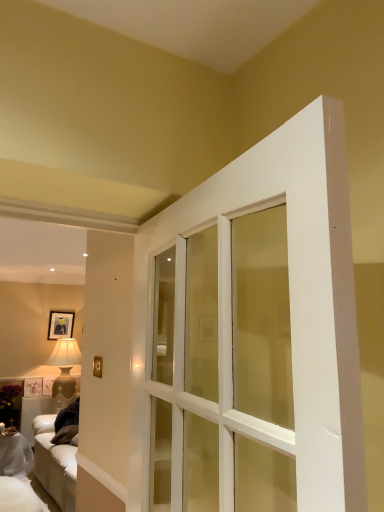
Question: From their relative heights in the image, would you say matte black picture frame at upper left is taller or shorter than white fabric couch at lower left?

Choices:
 (A) short
 (B) tall

Answer: (A)

Question: Would you say matte black picture frame at upper left is to the left or to the right of white fabric couch at lower left in the picture?

Choices:
 (A) left
 (B) right

Answer: (B)

Question: Which of these objects is positioned farthest from the matte beige lamp at left?

Choices:
 (A) matte black picture frame at upper left
 (B) white fabric couch at lower left

Answer: (B)

Question: Which object is the closest to the white fabric couch at lower left?

Choices:
 (A) matte beige lamp at left
 (B) matte black picture frame at upper left

Answer: (A)